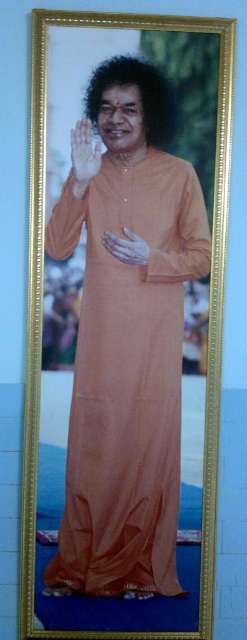
Looking at the framed portrait, you notice the curly hair at center and the translucent skin hand at center. Which of these two features is visually more prominent in terms of size?

The curly hair at center is larger in size than the translucent skin hand at center, making it more prominent.

You are an art restorer examining the framed portrait. You need to determine the spatial relationship between the curly hair at center and the translucent skin hand at center. Which object is positioned higher in the image?

The curly hair at center is taller than the translucent skin hand at center, so the curly hair at center is positioned higher in the image.